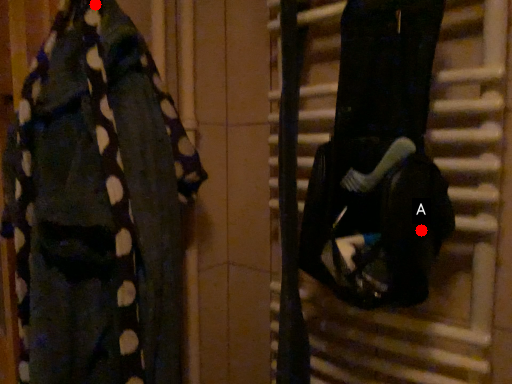
Question: Two points are circled on the image, labeled by A and B beside each circle. Which point is further to the camera?

Choices:
 (A) A is further
 (B) B is further

Answer: (B)